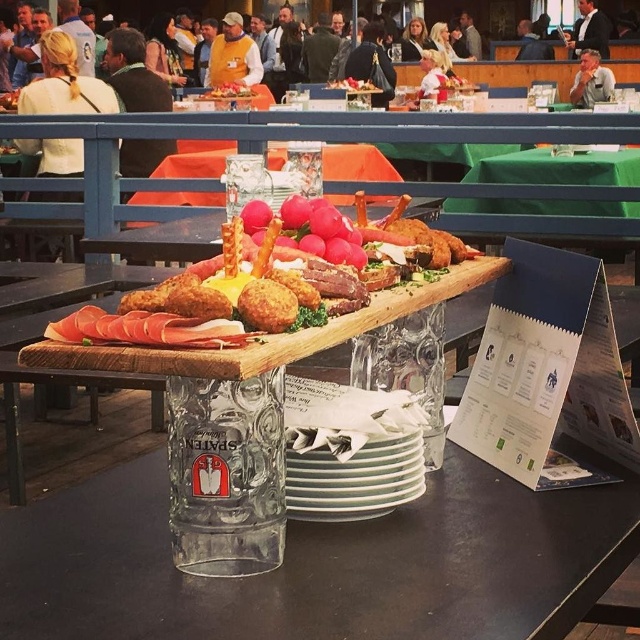
Can you confirm if transparent glass at center is positioned to the right of wooden board at center?

Yes, transparent glass at center is to the right of wooden board at center.

The height and width of the screenshot is (640, 640). What do you see at coordinates (321, 564) in the screenshot?
I see `transparent glass at center` at bounding box center [321, 564].

Who is more distant from viewer, (x=202, y=618) or (x=168, y=234)?

The point (x=168, y=234) is behind.

The width and height of the screenshot is (640, 640). In order to click on transparent glass at center in this screenshot , I will do `click(321, 564)`.

Who is shorter, transparent glass at center or smooth wooden board at center?

transparent glass at center is shorter.

Between point (394, 516) and point (212, 96), which one is positioned in front?

Point (394, 516) is in front.

At what (x,y) coordinates should I click in order to perform the action: click on transparent glass at center. Please return your answer as a coordinate pair (x, y). The width and height of the screenshot is (640, 640). Looking at the image, I should click on (321, 564).

Where is `wooden board at center`? This screenshot has height=640, width=640. wooden board at center is located at coordinates (173, 237).

In order to click on wooden board at center in this screenshot , I will do `click(173, 237)`.

Where is `wooden board at center`? This screenshot has height=640, width=640. wooden board at center is located at coordinates (173, 237).